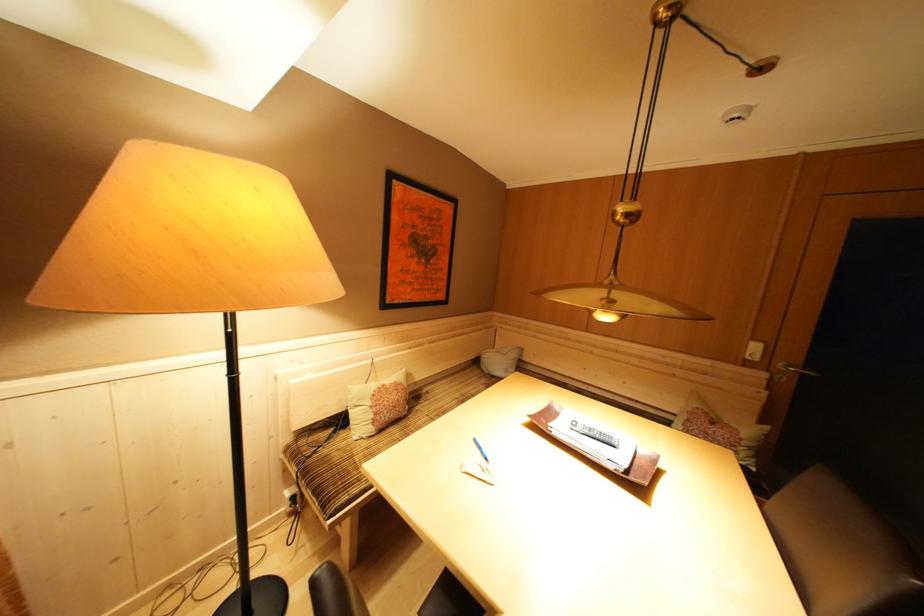
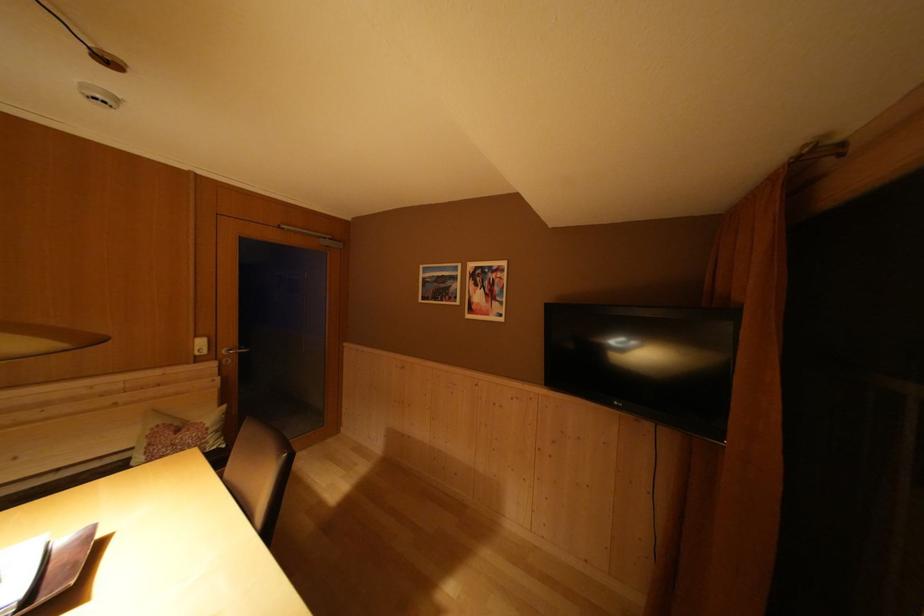
The point at [643,407] is marked in the first image. Where is the corresponding point in the second image?

(66, 475)